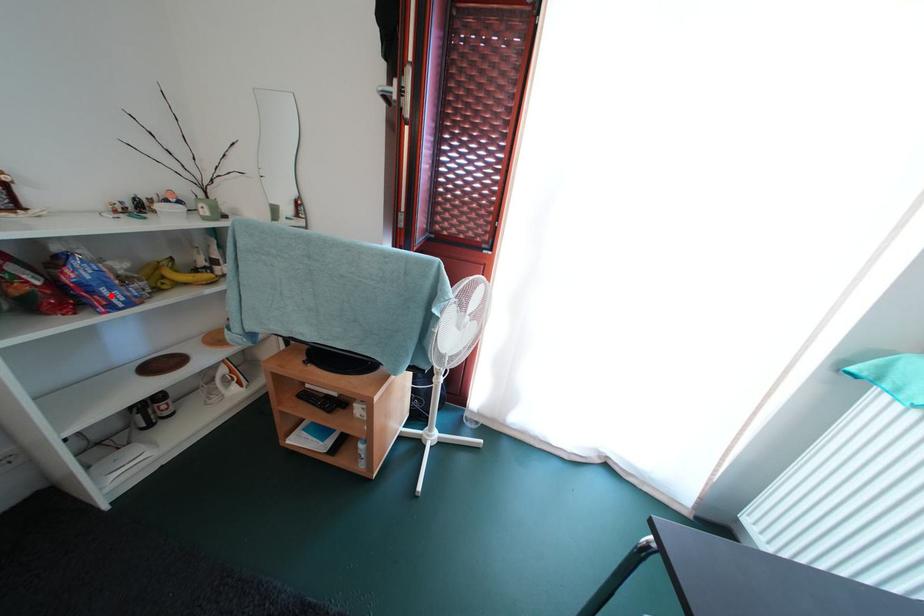
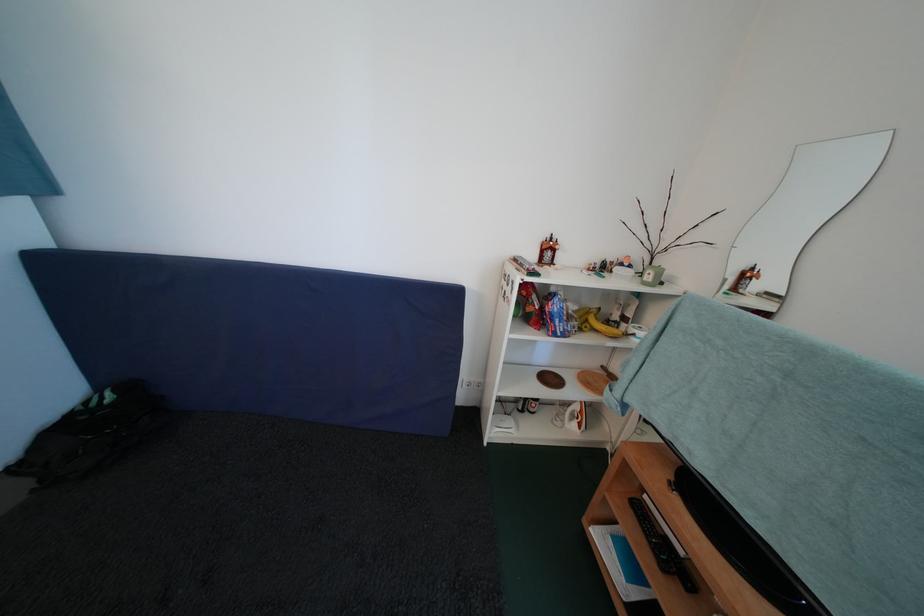
Find the pixel in the second image that matches the highlighted location in the first image.

(565, 326)